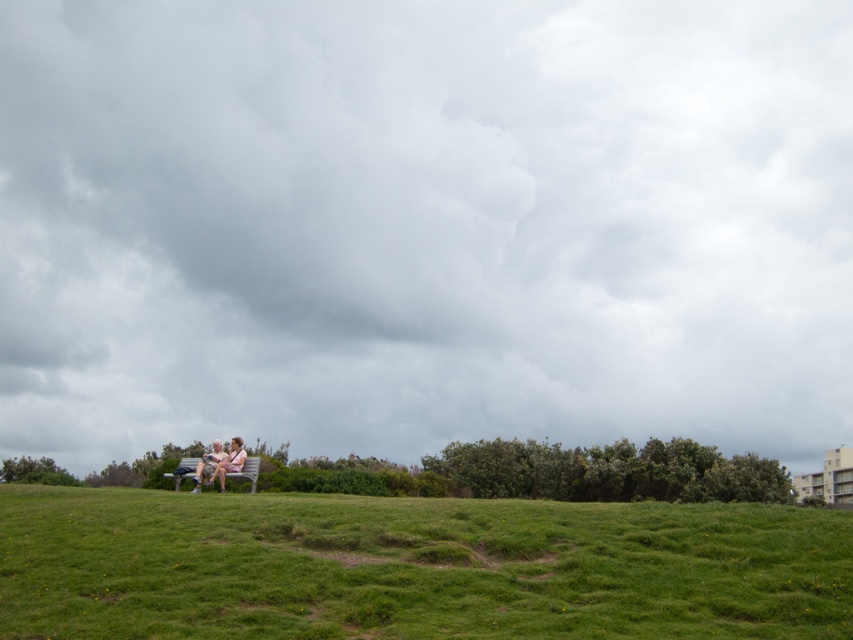
Question: Does cloudy sky at upper center have a lesser width compared to matte pink fabric couple at center?

Choices:
 (A) yes
 (B) no

Answer: (B)

Question: Which of these objects is positioned closest to the green grass at lower center?

Choices:
 (A) matte pink fabric couple at center
 (B) cloudy sky at upper center

Answer: (A)

Question: Considering the relative positions of cloudy sky at upper center and matte pink fabric couple at center in the image provided, where is cloudy sky at upper center located with respect to matte pink fabric couple at center?

Choices:
 (A) above
 (B) below

Answer: (A)

Question: Which point is closer to the camera taking this photo?

Choices:
 (A) (679, 548)
 (B) (228, 445)
 (C) (531, 163)

Answer: (A)

Question: Is green grass at lower center above matte pink fabric couple at center?

Choices:
 (A) yes
 (B) no

Answer: (B)

Question: Among these points, which one is farthest from the camera?

Choices:
 (A) (212, 477)
 (B) (230, 595)

Answer: (A)